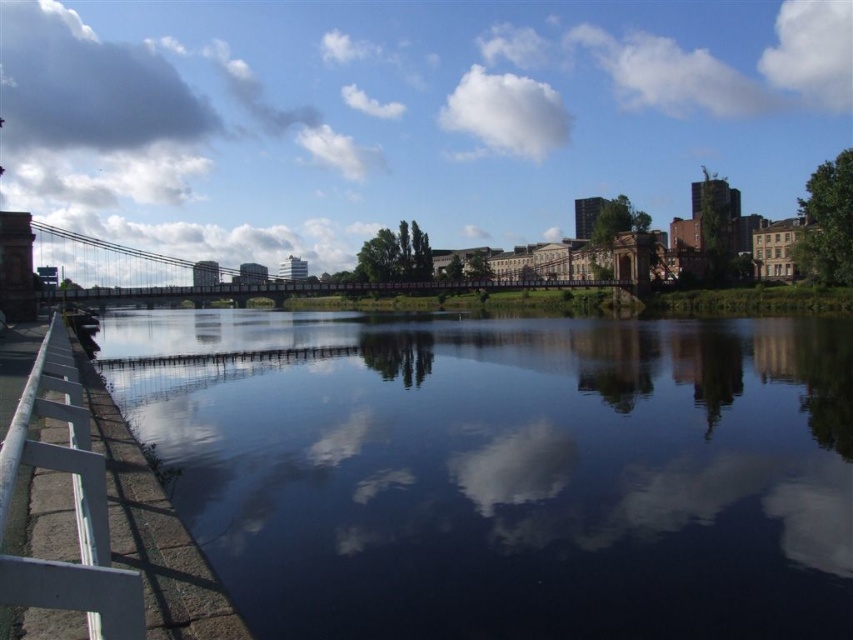
Does point (793, 362) come closer to viewer compared to point (90, 582)?

No, it is behind (90, 582).

Is black reflective water at center to the left of white metal rail at lower left from the viewer's perspective?

Incorrect, black reflective water at center is not on the left side of white metal rail at lower left.

At what (x,y) coordinates should I click in order to perform the action: click on black reflective water at center. Please return your answer as a coordinate pair (x, y). The width and height of the screenshot is (853, 640). Looking at the image, I should click on (508, 472).

Locate an element on the screen. black reflective water at center is located at coordinates (508, 472).

Measure the distance between black reflective water at center and metallic gray suspension bridge at center.

black reflective water at center is 212.82 feet away from metallic gray suspension bridge at center.

Describe the element at coordinates (508, 472) in the screenshot. This screenshot has height=640, width=853. I see `black reflective water at center` at that location.

At what (x,y) coordinates should I click in order to perform the action: click on black reflective water at center. Please return your answer as a coordinate pair (x, y). The image size is (853, 640). Looking at the image, I should click on (508, 472).

Can you confirm if white metal rail at lower left is thinner than metallic gray suspension bridge at center?

Yes.

Can you confirm if white metal rail at lower left is bigger than metallic gray suspension bridge at center?

Actually, white metal rail at lower left might be smaller than metallic gray suspension bridge at center.

I want to click on white metal rail at lower left, so click(x=73, y=502).

Image resolution: width=853 pixels, height=640 pixels. Find the location of `white metal rail at lower left`. white metal rail at lower left is located at coordinates (73, 502).